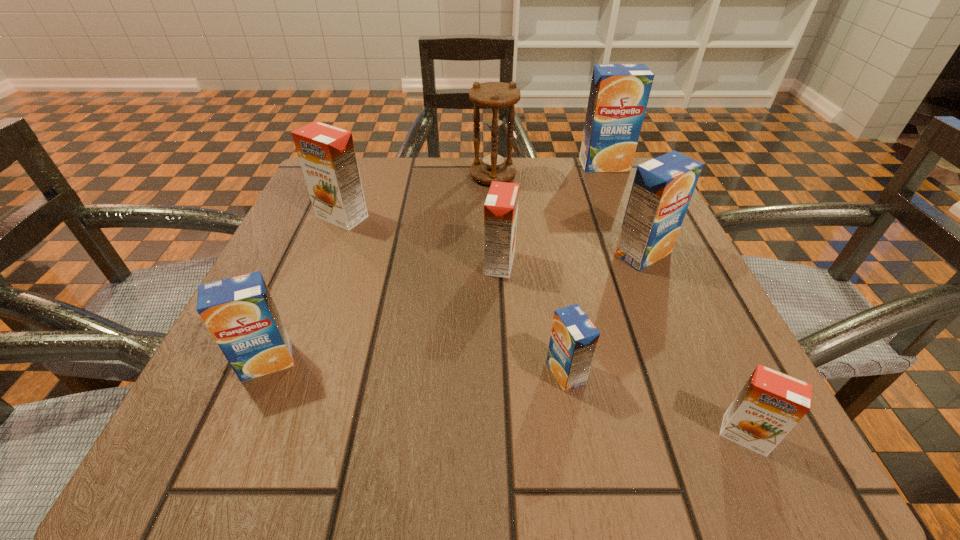
Locate an element on the screen. vacant space at the far left corner of the desktop is located at coordinates (373, 177).

In the image, there is a desktop. At what (x,y) coordinates should I click in order to perform the action: click on free space at the far right corner. Please return your answer as a coordinate pair (x, y). Looking at the image, I should click on (593, 207).

Image resolution: width=960 pixels, height=540 pixels. Identify the location of empty space that is in between the hourglass and the third biggest blue orange_juice. (380, 269).

Where is `free space between the third biggest blue orange_juice and the fifth orange juice from right to left`? The width and height of the screenshot is (960, 540). free space between the third biggest blue orange_juice and the fifth orange juice from right to left is located at coordinates (384, 313).

You are a GUI agent. You are given a task and a screenshot of the screen. Output one action in this format:
    pyautogui.click(x=<x>, y=<y>)
    Task: Click on the empty location between the third smallest blue orange_juice and the tallest orange juice
    This screenshot has width=960, height=540.
    Given the screenshot: What is the action you would take?
    pyautogui.click(x=623, y=209)

Locate an element on the screen. free space between the tallest orange juice and the third nearest blue orange_juice is located at coordinates (623, 209).

Find the location of a particular element. free space between the second smallest blue orange_juice and the farthest blue orange_juice is located at coordinates (436, 263).

In order to click on unoccupied position between the third biggest blue orange_juice and the second orange orange juice from right to left in this screenshot , I will do `click(384, 313)`.

Where is `free space between the second smallest blue orange_juice and the biggest orange orange juice`? free space between the second smallest blue orange_juice and the biggest orange orange juice is located at coordinates (305, 289).

Find the location of a particular element. The image size is (960, 540). vacant area that lies between the smallest blue orange_juice and the third farthest object is located at coordinates (454, 295).